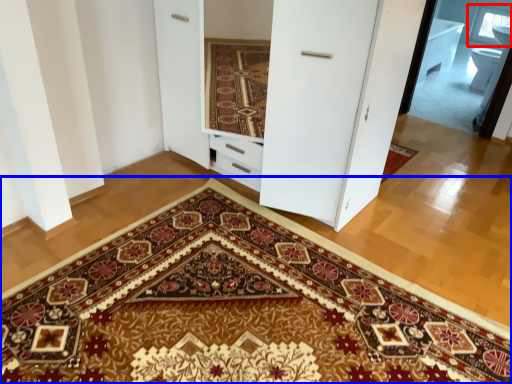
Question: Among these objects, which one is nearest to the camera, window (highlighted by a red box) or doormat (highlighted by a blue box)?

Choices:
 (A) window
 (B) doormat

Answer: (B)